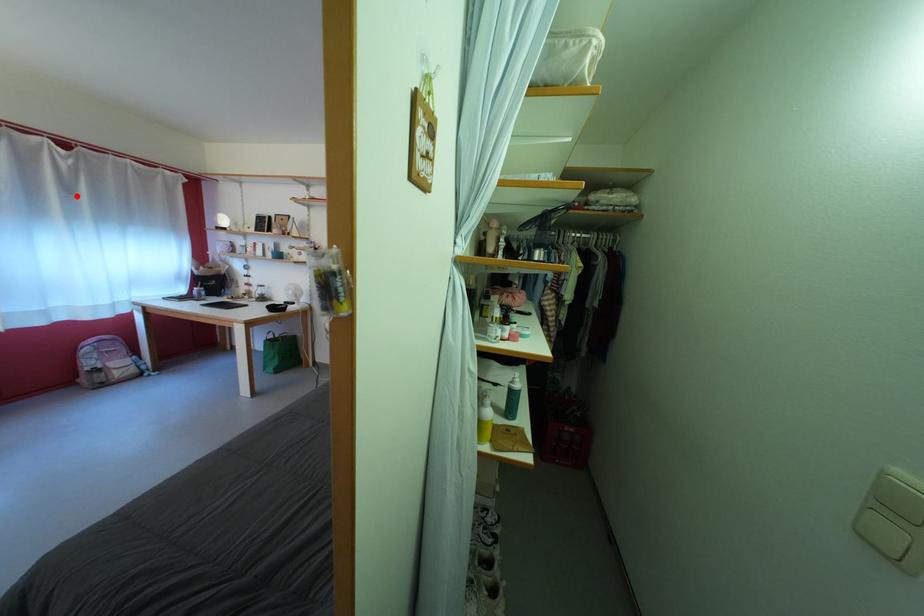
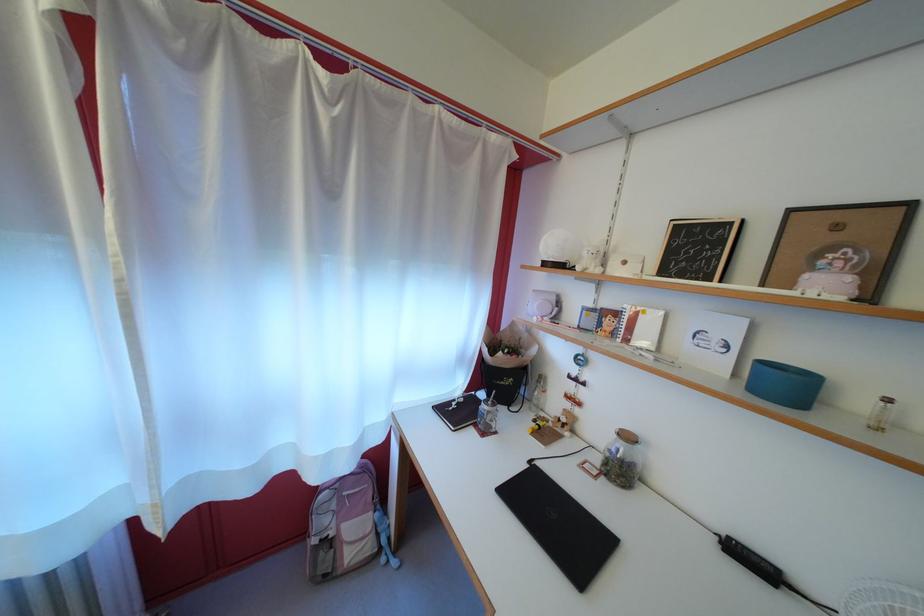
Locate, in the second image, the point that corresponds to the highlighted location in the first image.

(335, 193)